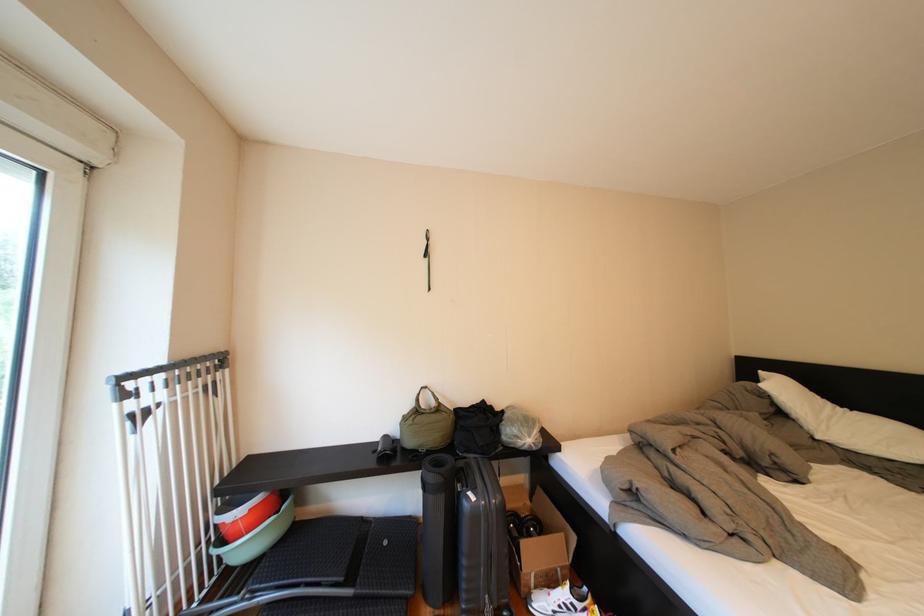
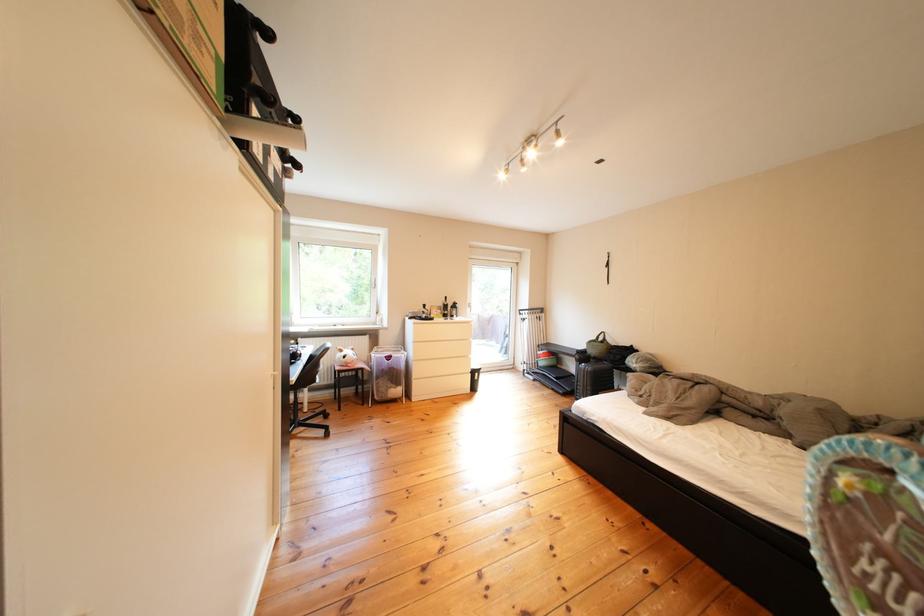
Question: I am providing you with two images of the same scene from different viewpoints. Which of the following objects are not visible in image2?

Choices:
 (A) dresser drawer handle
 (B) blue patterned bag
 (C) black dumbbell
 (D) black suitcase

Answer: (C)